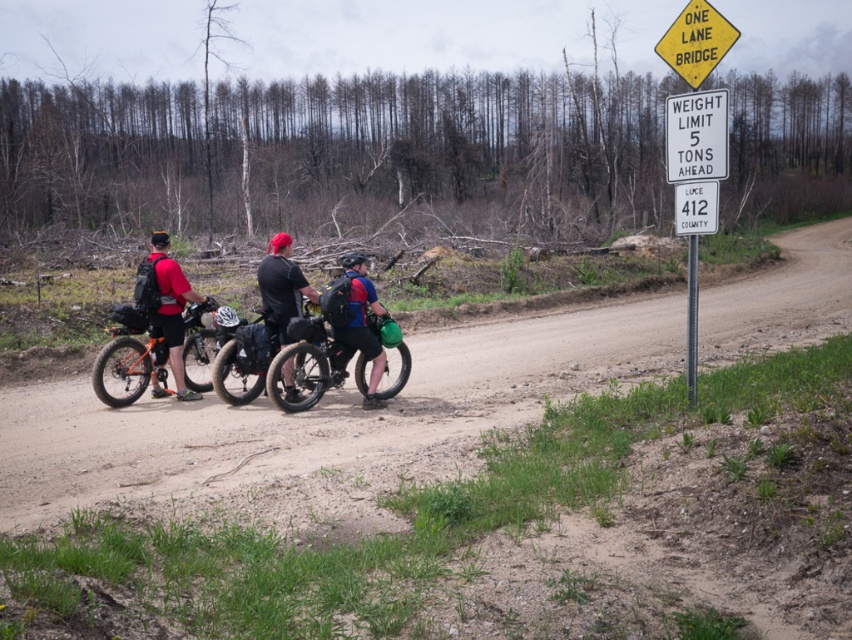
You are a cyclist approaching the white plastic sign at right and need to continue on the brown dirt track at center. Which direction should you head relative to the sign?

The brown dirt track at center is below the white plastic sign at right, so you should head downward from the sign to continue on the brown dirt track at center.

In the scene shown: You are a cyclist standing at the camera position. You need to check if your orange matte bicycle at left is within the 30 feet safety zone before the One Lane Bridge. Is it within the zone?

The orange matte bicycle at left is 29.07 feet away from the camera, which is within the 30 feet safety zone before the One Lane Bridge.